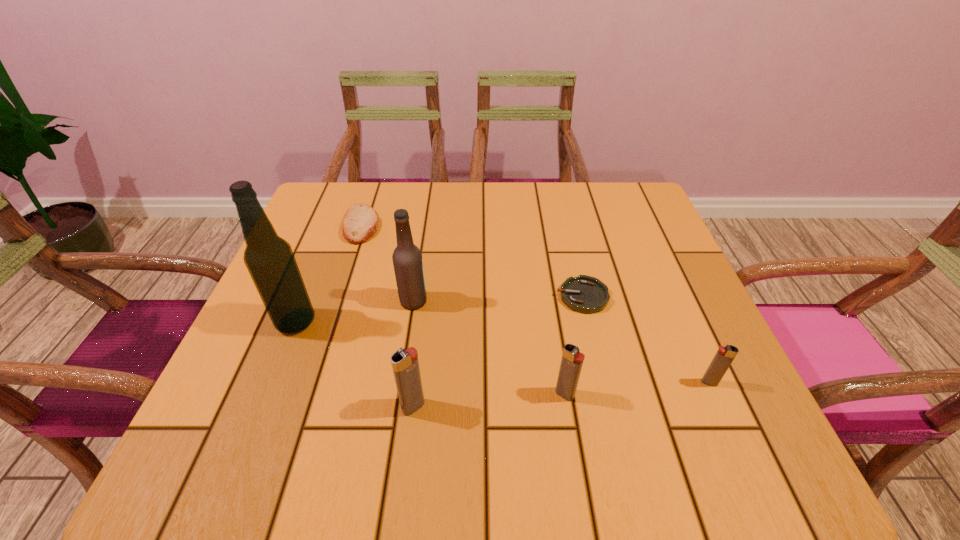
The width and height of the screenshot is (960, 540). What are the coordinates of `pita bread that is at the left edge` in the screenshot? It's located at (361, 222).

Locate an element on the screen. The image size is (960, 540). alcohol at the left edge is located at coordinates (269, 258).

The image size is (960, 540). In order to click on object present at the right edge in this screenshot , I will do `click(723, 358)`.

Identify the location of object at the far left corner. (361, 222).

At what (x,y) coordinates should I click in order to perform the action: click on object present at the near right corner. Please return your answer as a coordinate pair (x, y). This screenshot has height=540, width=960. Looking at the image, I should click on (723, 358).

Locate an element on the screen. This screenshot has width=960, height=540. vacant space at the far edge is located at coordinates (x=565, y=225).

Locate an element on the screen. This screenshot has height=540, width=960. vacant space at the near edge of the desktop is located at coordinates (483, 408).

In the image, there is a desktop. Identify the location of vacant area at the left edge. This screenshot has width=960, height=540. (267, 364).

In the image, there is a desktop. In order to click on vacant space at the right edge in this screenshot , I will do `click(667, 334)`.

The width and height of the screenshot is (960, 540). Identify the location of vacant space at the near left corner. (244, 391).